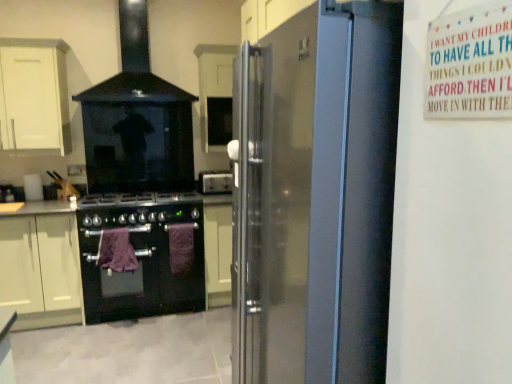
Question: Considering the relative sizes of black glass stove at upper center and white matte cabinet at center, which is the first cabinetry from right to left, in the image provided, is black glass stove at upper center thinner than white matte cabinet at center, which is the first cabinetry from right to left,?

Choices:
 (A) yes
 (B) no

Answer: (B)

Question: Can you confirm if black glass stove at upper center is bigger than white matte cabinet at center, which is the first cabinetry from right to left?

Choices:
 (A) no
 (B) yes

Answer: (B)

Question: Is the depth of black glass stove at upper center less than that of white matte cabinet at center, which is the first cabinetry from right to left?

Choices:
 (A) no
 (B) yes

Answer: (B)

Question: Can you confirm if black glass stove at upper center is positioned to the right of white matte cabinet at center, arranged as the 3th cabinetry when viewed from the left?

Choices:
 (A) yes
 (B) no

Answer: (B)

Question: Would you say black glass stove at upper center is a long distance from white matte cabinet at center, which is the first cabinetry from right to left?

Choices:
 (A) no
 (B) yes

Answer: (A)

Question: From a real-world perspective, relative to white wooden sign at upper right, is black matte gas stove at center vertically above or below?

Choices:
 (A) above
 (B) below

Answer: (B)

Question: From the image's perspective, relative to white wooden sign at upper right, is black matte gas stove at center above or below?

Choices:
 (A) below
 (B) above

Answer: (A)

Question: Considering the relative positions of black matte gas stove at center and white wooden sign at upper right in the image provided, is black matte gas stove at center to the left or to the right of white wooden sign at upper right?

Choices:
 (A) left
 (B) right

Answer: (A)

Question: Considering their positions, is black matte gas stove at center located in front of or behind white wooden sign at upper right?

Choices:
 (A) behind
 (B) front

Answer: (A)

Question: Do you think white matte cabinet at upper left, which ranks as the 2th cabinetry in right-to-left order, is within black matte gas stove at center, or outside of it?

Choices:
 (A) outside
 (B) inside

Answer: (A)

Question: In terms of height, does white matte cabinet at upper left, arranged as the second cabinetry when viewed from the left, look taller or shorter compared to black matte gas stove at center?

Choices:
 (A) tall
 (B) short

Answer: (A)

Question: In the image, is white matte cabinet at upper left, arranged as the second cabinetry when viewed from the left, positioned in front of or behind black matte gas stove at center?

Choices:
 (A) front
 (B) behind

Answer: (A)

Question: Considering the positions of white matte cabinet at upper left, which ranks as the 2th cabinetry in right-to-left order, and black matte gas stove at center in the image, is white matte cabinet at upper left, which ranks as the 2th cabinetry in right-to-left order, wider or thinner than black matte gas stove at center?

Choices:
 (A) wide
 (B) thin

Answer: (B)

Question: From the image's perspective, is white matte cabinet at center, which is the first cabinetry from right to left, above or below satin black refrigerator at right?

Choices:
 (A) below
 (B) above

Answer: (B)

Question: Looking at their shapes, would you say white matte cabinet at center, arranged as the 3th cabinetry when viewed from the left, is wider or thinner than satin black refrigerator at right?

Choices:
 (A) wide
 (B) thin

Answer: (B)